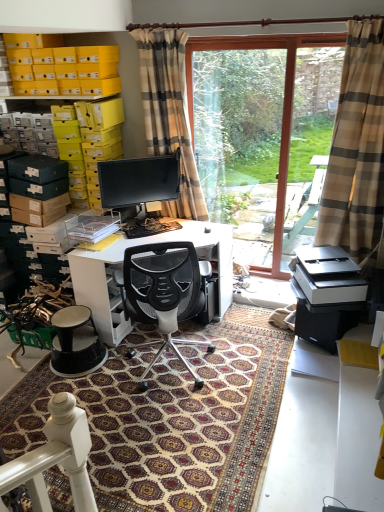
Question: Should I look upward or downward to see patterned carpet at center?

Choices:
 (A) down
 (B) up

Answer: (A)

Question: Considering the relative sizes of beige plaid curtain at right, marked as the 2th curtain in a left-to-right arrangement, and white glossy desk at center in the image provided, is beige plaid curtain at right, marked as the 2th curtain in a left-to-right arrangement, wider than white glossy desk at center?

Choices:
 (A) no
 (B) yes

Answer: (A)

Question: Does beige plaid curtain at right, marked as the 2th curtain in a left-to-right arrangement, appear on the left side of white glossy desk at center?

Choices:
 (A) yes
 (B) no

Answer: (B)

Question: From a real-world perspective, is beige plaid curtain at right, marked as the 2th curtain in a left-to-right arrangement, on white glossy desk at center?

Choices:
 (A) yes
 (B) no

Answer: (A)

Question: Is beige plaid curtain at right, the first curtain when ordered from right to left, positioned far away from white glossy desk at center?

Choices:
 (A) no
 (B) yes

Answer: (B)

Question: Is beige plaid curtain at right, the first curtain when ordered from right to left, further to camera compared to white glossy desk at center?

Choices:
 (A) no
 (B) yes

Answer: (A)

Question: Can you confirm if beige plaid curtain at right, the first curtain when ordered from right to left, is bigger than white glossy desk at center?

Choices:
 (A) yes
 (B) no

Answer: (B)

Question: Does white glossy desk at center have a greater height compared to yellow cardboard boxes at upper left?

Choices:
 (A) no
 (B) yes

Answer: (B)

Question: Is white glossy desk at center further to camera compared to yellow cardboard boxes at upper left?

Choices:
 (A) no
 (B) yes

Answer: (A)

Question: Is white glossy desk at center bigger than yellow cardboard boxes at upper left?

Choices:
 (A) no
 (B) yes

Answer: (B)

Question: Can you confirm if white glossy desk at center is positioned to the right of yellow cardboard boxes at upper left?

Choices:
 (A) no
 (B) yes

Answer: (B)

Question: Does white glossy desk at center have a lesser width compared to yellow cardboard boxes at upper left?

Choices:
 (A) no
 (B) yes

Answer: (A)

Question: Is white glossy desk at center aimed at yellow cardboard boxes at upper left?

Choices:
 (A) no
 (B) yes

Answer: (A)

Question: Considering the relative positions of patterned carpet at center and white glossy desk at center in the image provided, is patterned carpet at center in front of white glossy desk at center?

Choices:
 (A) yes
 (B) no

Answer: (A)